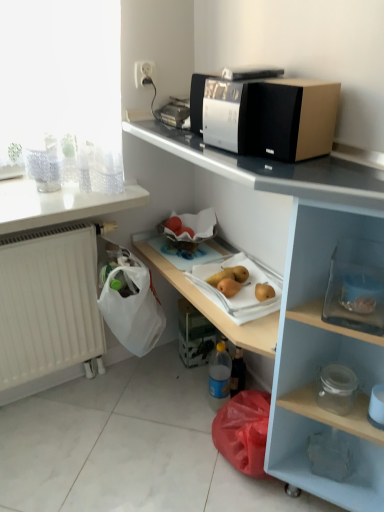
You are a GUI agent. You are given a task and a screenshot of the screen. Output one action in this format:
    pyautogui.click(x=<x>, y=<y>)
    Task: Click on the white matte radiator at lower left
    
    Given the screenshot: What is the action you would take?
    [48, 307]

Image resolution: width=384 pixels, height=512 pixels. What do you see at coordinates (229, 280) in the screenshot?
I see `yellow matte pears at center, which is counted as the 2th fruit, starting from the left` at bounding box center [229, 280].

Measure the distance between point (306,377) and camera.

Point (306,377) and camera are 4.11 feet apart.

What is the approximate height of transparent glass jar at lower right, the 2th appliance from the top?

4.33 inches.

Identify the location of white matte radiator at lower left. (48, 307).

Could you measure the distance between yellow matte pears at center, which is counted as the 2th fruit, starting from the left, and transparent glass jar at lower right, the 2th appliance from the top?

yellow matte pears at center, which is counted as the 2th fruit, starting from the left, and transparent glass jar at lower right, the 2th appliance from the top, are 15.93 inches apart.

From a real-world perspective, is yellow matte pears at center, which is counted as the 2th fruit, starting from the left, below transparent glass jar at lower right, placed as the first appliance when sorted from bottom to top?

No.

In the scene shown: Does yellow matte pears at center, marked as the first fruit in a right-to-left arrangement, touch transparent glass jar at lower right, the second appliance from the left?

yellow matte pears at center, marked as the first fruit in a right-to-left arrangement, and transparent glass jar at lower right, the second appliance from the left, are not in contact.

Is yellow matte pears at center, which is counted as the 2th fruit, starting from the left, turned away from transparent glass jar at lower right, placed as the first appliance when sorted from bottom to top?

No, yellow matte pears at center, which is counted as the 2th fruit, starting from the left,'s orientation is not away from transparent glass jar at lower right, placed as the first appliance when sorted from bottom to top.

Which of these two, silver metallic microwave at upper center or transparent glass container at lower right, which appears as the 1th box when viewed from the right, is wider?

silver metallic microwave at upper center is wider.

Which is in front, silver metallic microwave at upper center or transparent glass container at lower right, the 1th box from the front?

transparent glass container at lower right, the 1th box from the front, is more forward.

Is silver metallic microwave at upper center aimed at transparent glass container at lower right, which appears as the 1th box when viewed from the right?

No, silver metallic microwave at upper center is not turned towards transparent glass container at lower right, which appears as the 1th box when viewed from the right.

Is silver metallic microwave at upper center at the right side of transparent glass container at lower right, which appears as the 1th box when viewed from the right?

In fact, silver metallic microwave at upper center is to the left of transparent glass container at lower right, which appears as the 1th box when viewed from the right.

How different are the orientations of transparent glass container at lower right, arranged as the second box when viewed from the left, and yellow matte pear at lower center, the 2th fruit in the right-to-left sequence, in degrees?

The facing directions of transparent glass container at lower right, arranged as the second box when viewed from the left, and yellow matte pear at lower center, the 2th fruit in the right-to-left sequence, are 53.7 degrees apart.

Is transparent glass container at lower right, arranged as the second box when viewed from the left, far away from yellow matte pear at lower center, the 2th fruit in the right-to-left sequence?

No, transparent glass container at lower right, arranged as the second box when viewed from the left, is not far away from yellow matte pear at lower center, the 2th fruit in the right-to-left sequence.

Consider the image. From the image's perspective, between transparent glass container at lower right, which appears as the 1th box when viewed from the right, and yellow matte pear at lower center, which is counted as the 1th fruit, starting from the left, who is located below?

yellow matte pear at lower center, which is counted as the 1th fruit, starting from the left.

The image size is (384, 512). I want to click on box that is on the right side of yellow matte pear at lower center, which is counted as the 1th fruit, starting from the left, so click(x=356, y=286).

From a real-world perspective, is white matte radiator at lower left on top of white glossy countertop at upper center, which is counted as the second countertop, starting from the left?

No, from a real-world perspective, white matte radiator at lower left is not on top of white glossy countertop at upper center, which is counted as the second countertop, starting from the left.

Is white matte radiator at lower left far from white glossy countertop at upper center, which is counted as the second countertop, starting from the left?

No, white matte radiator at lower left is in close proximity to white glossy countertop at upper center, which is counted as the second countertop, starting from the left.

In terms of width, does white matte radiator at lower left look wider or thinner when compared to white glossy countertop at upper center, which is the first countertop from right to left?

In the image, white matte radiator at lower left appears to be more narrow than white glossy countertop at upper center, which is the first countertop from right to left.

From the image's perspective, which one is positioned lower, white matte radiator at lower left or white glossy countertop at upper center, which is counted as the second countertop, starting from the left?

white matte radiator at lower left.

Is white glossy countertop at upper left, which ranks as the 2th countertop in right-to-left order, further to camera compared to silver metallic microwave at upper center?

Yes, the depth of white glossy countertop at upper left, which ranks as the 2th countertop in right-to-left order, is greater than that of silver metallic microwave at upper center.

Does point (40, 217) lie in front of point (286, 159)?

No.

Between white glossy countertop at upper left, which ranks as the 2th countertop in right-to-left order, and silver metallic microwave at upper center, which one has smaller size?

silver metallic microwave at upper center is smaller.

Considering the sizes of objects white glossy countertop at upper left, which ranks as the 2th countertop in right-to-left order, and silver metallic microwave at upper center in the image provided, who is taller, white glossy countertop at upper left, which ranks as the 2th countertop in right-to-left order, or silver metallic microwave at upper center?

silver metallic microwave at upper center is taller.

Is silver metallic microwave at upper center further to camera compared to translucent plastic container at lower center, arranged as the 1th box when viewed from the left?

That is False.

In terms of height, does silver metallic microwave at upper center look taller or shorter compared to translucent plastic container at lower center, the second box in the right-to-left sequence?

Considering their sizes, silver metallic microwave at upper center has less height than translucent plastic container at lower center, the second box in the right-to-left sequence.

What's the angular difference between silver metallic microwave at upper center and translucent plastic container at lower center, arranged as the 1th box when viewed from the left,'s facing directions?

silver metallic microwave at upper center and translucent plastic container at lower center, arranged as the 1th box when viewed from the left, are facing 78.1 degrees away from each other.

Are silver metallic microwave at upper center and translucent plastic container at lower center, the second box in the right-to-left sequence, making contact?

silver metallic microwave at upper center and translucent plastic container at lower center, the second box in the right-to-left sequence, are clearly separated.

From the image's perspective, between transparent glass jar at lower right, the second appliance from the left, and yellow matte pear at lower center, which is counted as the 1th fruit, starting from the left, who is located below?

transparent glass jar at lower right, the second appliance from the left, from the image's perspective.

Is transparent glass jar at lower right, placed as the first appliance when sorted from bottom to top, wider or thinner than yellow matte pear at lower center, the 2th fruit in the right-to-left sequence?

In the image, transparent glass jar at lower right, placed as the first appliance when sorted from bottom to top, appears to be wider than yellow matte pear at lower center, the 2th fruit in the right-to-left sequence.

Image resolution: width=384 pixels, height=512 pixels. In the image, there is a yellow matte pears at center, which is counted as the 2th fruit, starting from the left. What are the coordinates of `appliance below it (from the image's perspective)` in the screenshot? It's located at (336, 389).

I want to click on home appliance above the transparent glass container at lower right, arranged as the second box when viewed from the left (from a real-world perspective), so click(x=265, y=116).

Looking at this image, when comparing their distances from yellow matte pear at lower center, which is counted as the 1th fruit, starting from the left, does transparent glass jar at lower right, the 2th appliance from the top, or yellow matte pears at center, marked as the first fruit in a right-to-left arrangement, seem closer?

Among the two, yellow matte pears at center, marked as the first fruit in a right-to-left arrangement, is located nearer to yellow matte pear at lower center, which is counted as the 1th fruit, starting from the left.

Considering their positions, is white plastic socket at upper center positioned closer to black plastic microwave at upper center, which ranks as the 2th appliance in bottom-to-top order, than silver metallic microwave at upper center?

Among the two, silver metallic microwave at upper center is located nearer to black plastic microwave at upper center, which ranks as the 2th appliance in bottom-to-top order.

Which object lies further to the anchor point white matte radiator at lower left, white plastic socket at upper center or white glossy countertop at upper center, which is counted as the second countertop, starting from the left?

The object further to white matte radiator at lower left is white plastic socket at upper center.

Considering their positions, is black plastic microwave at upper center, which ranks as the 2th appliance in bottom-to-top order, positioned closer to white plastic socket at upper center than white glossy countertop at upper left, which appears as the 1th countertop when viewed from the left?

black plastic microwave at upper center, which ranks as the 2th appliance in bottom-to-top order.

When comparing their distances from yellow matte pears at center, marked as the first fruit in a right-to-left arrangement, does translucent plastic container at lower center, the first box when ordered from back to front, or silver metallic microwave at upper center seem further?

silver metallic microwave at upper center is positioned further to the anchor yellow matte pears at center, marked as the first fruit in a right-to-left arrangement.

Looking at the image, which one is located further to yellow matte pears at center, marked as the first fruit in a right-to-left arrangement, translucent plastic container at lower center, placed as the 2th box when sorted from front to back, or white plastic socket at upper center?

white plastic socket at upper center is further to yellow matte pears at center, marked as the first fruit in a right-to-left arrangement.

Which object lies nearer to the anchor point translucent plastic container at lower center, acting as the second box starting from the top, white matte radiator at lower left or white glossy countertop at upper left, which ranks as the 2th countertop in right-to-left order?

white matte radiator at lower left.

Considering their positions, is transparent glass container at lower right, the second box from the bottom, positioned closer to white matte radiator at lower left than white plastic socket at upper center?

white plastic socket at upper center is closer to white matte radiator at lower left.

Where is `box between white plastic socket at upper center and yellow matte pears at center, which is counted as the 2th fruit, starting from the left, vertically`? This screenshot has height=512, width=384. box between white plastic socket at upper center and yellow matte pears at center, which is counted as the 2th fruit, starting from the left, vertically is located at coordinates (356, 286).

Where is `home appliance between black plastic microwave at upper center, arranged as the 1th appliance when viewed from the left, and transparent glass container at lower right, the 1th box from the front, in the up-down direction`? The height and width of the screenshot is (512, 384). home appliance between black plastic microwave at upper center, arranged as the 1th appliance when viewed from the left, and transparent glass container at lower right, the 1th box from the front, in the up-down direction is located at coordinates (265, 116).

You are a GUI agent. You are given a task and a screenshot of the screen. Output one action in this format:
    pyautogui.click(x=<x>, y=<y>)
    Task: Click on the appliance that lies between white plastic socket at upper center and yellow matte pears at center, which is counted as the 2th fruit, starting from the left, from top to bottom
    The width and height of the screenshot is (384, 512).
    Given the screenshot: What is the action you would take?
    pyautogui.click(x=251, y=73)

Locate an element on the screen. The image size is (384, 512). appliance between white matte radiator at lower left and white glossy countertop at upper center, which is the first countertop from right to left, from left to right is located at coordinates (251, 73).